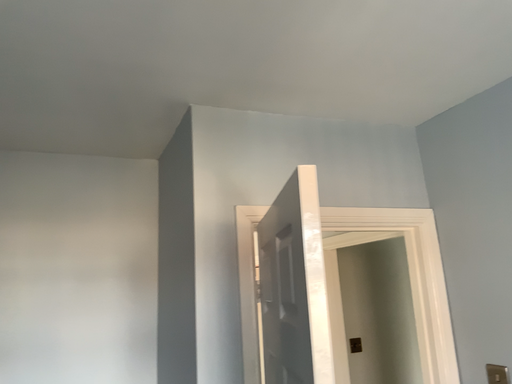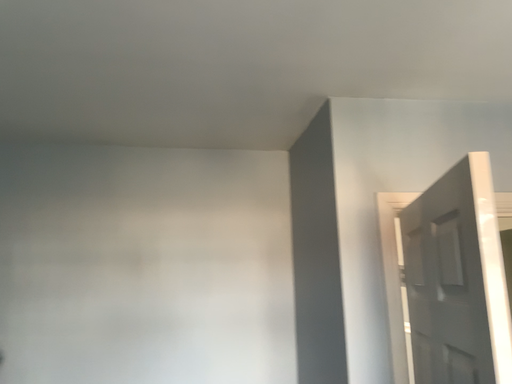
Question: How did the camera likely rotate when shooting the video?

Choices:
 (A) rotated left
 (B) rotated right

Answer: (A)